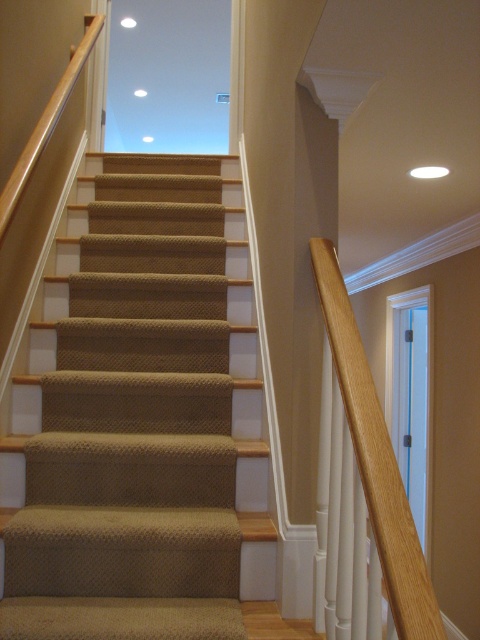
Does beige carpeted stairs at center have a lesser height compared to wooden handrail at right?

Correct, beige carpeted stairs at center is not as tall as wooden handrail at right.

Describe the element at coordinates (134, 426) in the screenshot. Image resolution: width=480 pixels, height=640 pixels. I see `beige carpeted stairs at center` at that location.

Where is `beige carpeted stairs at center`? This screenshot has width=480, height=640. beige carpeted stairs at center is located at coordinates (134, 426).